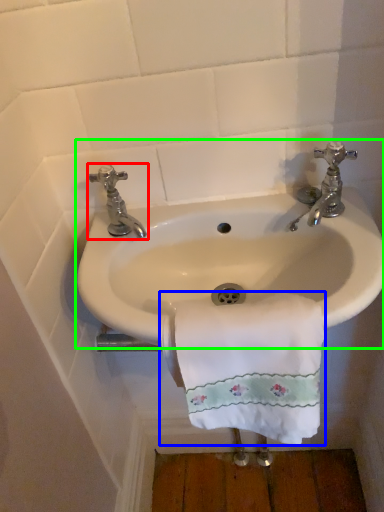
Question: Estimate the real-world distances between objects in this image. Which object is closer to tap (highlighted by a red box), towel/napkin (highlighted by a blue box) or sink (highlighted by a green box)?

Choices:
 (A) towel/napkin
 (B) sink

Answer: (B)